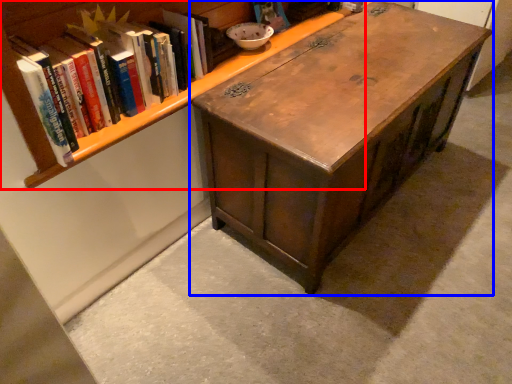
Question: Which object is further to the camera taking this photo, bookcase (highlighted by a red box) or table (highlighted by a blue box)?

Choices:
 (A) bookcase
 (B) table

Answer: (B)